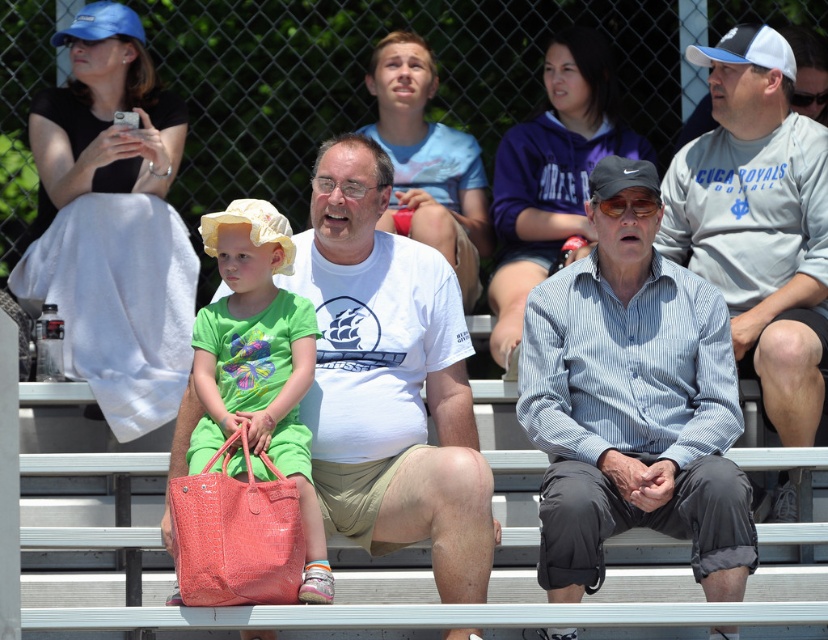
This screenshot has height=640, width=828. What do you see at coordinates (632, 401) in the screenshot?
I see `striped cotton shirt at center` at bounding box center [632, 401].

Identify the location of striped cotton shirt at center. This screenshot has width=828, height=640. (632, 401).

Which is more to the right, white matte shirt at center or matte pink crocodile-patterned handbag at center?

Positioned to the right is white matte shirt at center.

Is white matte shirt at center taller than matte pink crocodile-patterned handbag at center?

Correct, white matte shirt at center is much taller as matte pink crocodile-patterned handbag at center.

Which is in front, point (333, 438) or point (236, 301)?

Point (236, 301) is in front.

I want to click on white matte shirt at center, so click(x=390, y=380).

Measure the distance between point (764, 266) and camera.

16.25 meters

Which is more to the left, gray cotton shirt at center or coral crocodile-patterned handbag at center?

coral crocodile-patterned handbag at center

The width and height of the screenshot is (828, 640). Describe the element at coordinates (758, 221) in the screenshot. I see `gray cotton shirt at center` at that location.

The width and height of the screenshot is (828, 640). I want to click on gray cotton shirt at center, so click(x=758, y=221).